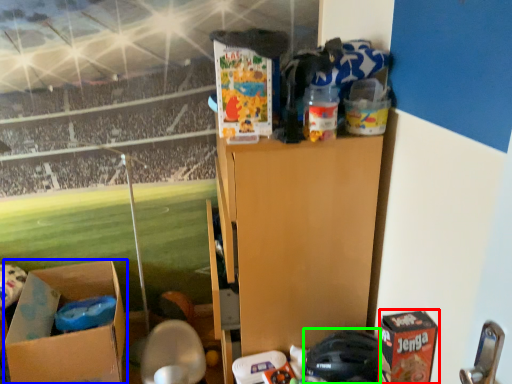
Question: Which object is positioned farthest from cardboard box (highlighted by a red box)? Select from box (highlighted by a blue box) and toy (highlighted by a green box).

Choices:
 (A) box
 (B) toy

Answer: (A)